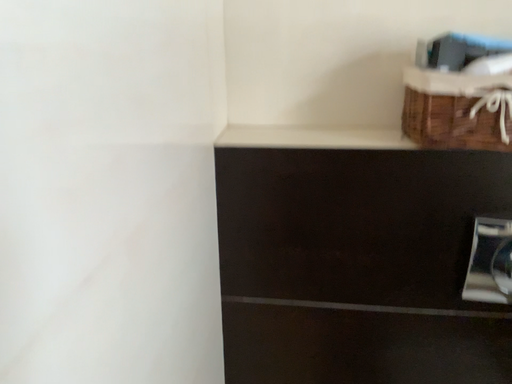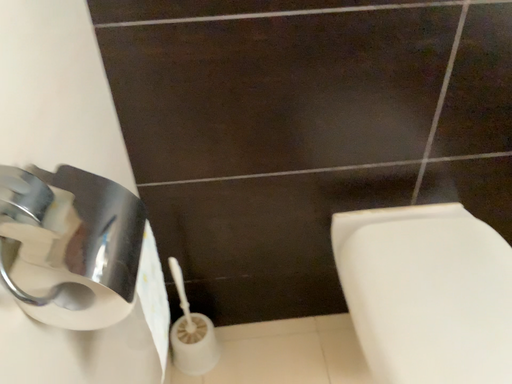
Question: Which way did the camera rotate in the video?

Choices:
 (A) rotated right
 (B) rotated left

Answer: (A)